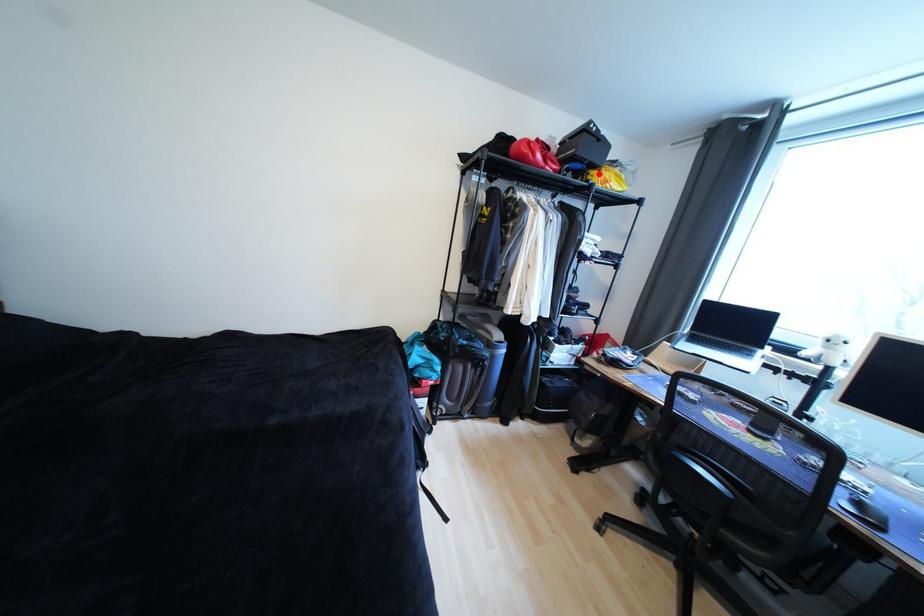
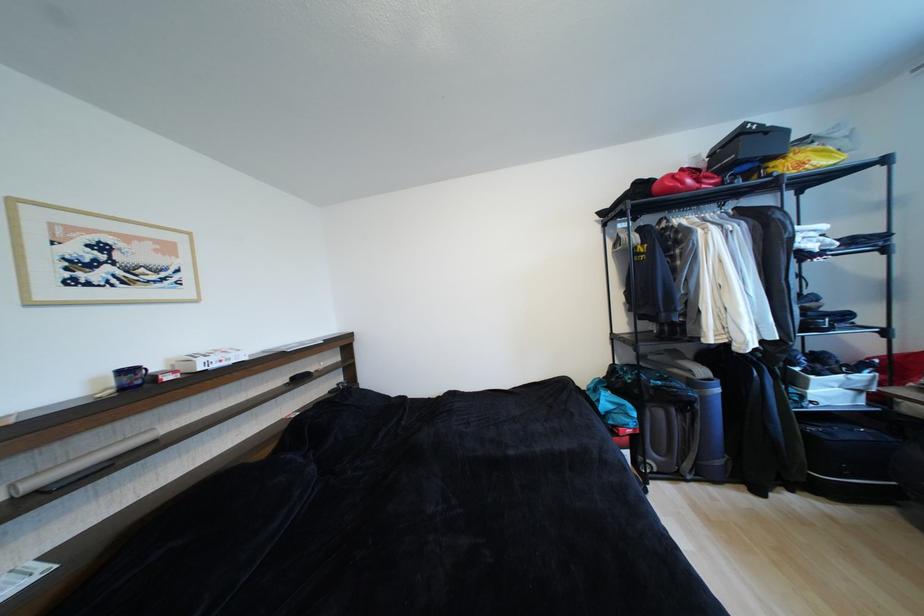
Locate, in the second image, the point that corresponds to the highlighted location in the first image.

(780, 166)